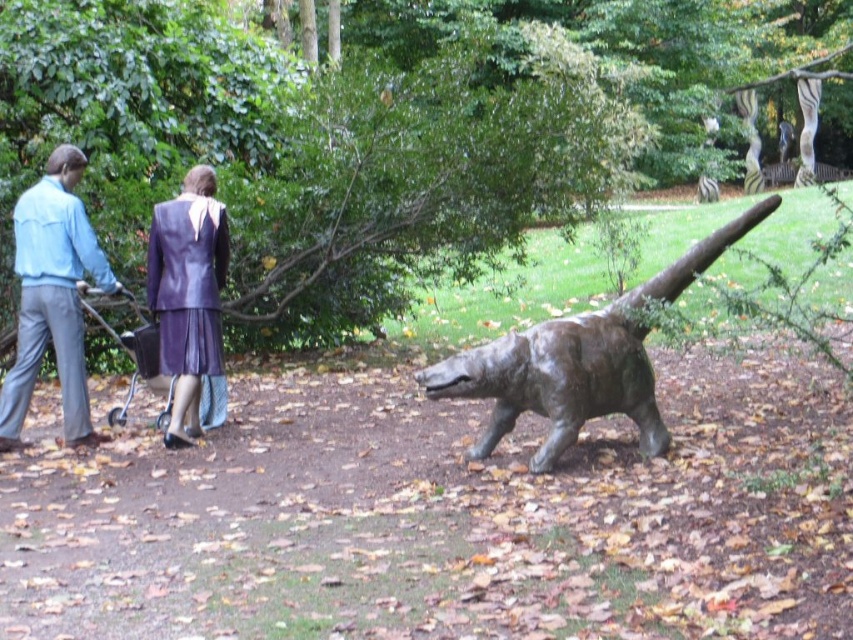
Is purple leather suit at upper left smaller than metallic silver baby carriage at left?

Indeed, purple leather suit at upper left has a smaller size compared to metallic silver baby carriage at left.

Can you confirm if purple leather suit at upper left is positioned above metallic silver baby carriage at left?

Indeed, purple leather suit at upper left is positioned over metallic silver baby carriage at left.

What do you see at coordinates (189, 292) in the screenshot? I see `purple leather suit at upper left` at bounding box center [189, 292].

The image size is (853, 640). In order to click on purple leather suit at upper left in this screenshot , I will do `click(189, 292)`.

Can you confirm if light blue denim jacket at left is positioned to the right of metallic silver baby carriage at left?

Incorrect, light blue denim jacket at left is not on the right side of metallic silver baby carriage at left.

Consider the image. Is light blue denim jacket at left below metallic silver baby carriage at left?

No, light blue denim jacket at left is not below metallic silver baby carriage at left.

What do you see at coordinates (53, 296) in the screenshot? I see `light blue denim jacket at left` at bounding box center [53, 296].

Find the location of a particular element. This screenshot has height=640, width=853. light blue denim jacket at left is located at coordinates tap(53, 296).

Is point (511, 349) closer to camera compared to point (175, 368)?

Yes, it is.

Can you confirm if bronze statue at center is smaller than purple leather suit at upper left?

Actually, bronze statue at center might be larger than purple leather suit at upper left.

Which is in front, point (590, 388) or point (224, 227)?

Point (590, 388) is in front.

Where is `bronze statue at center`? This screenshot has width=853, height=640. bronze statue at center is located at coordinates (579, 362).